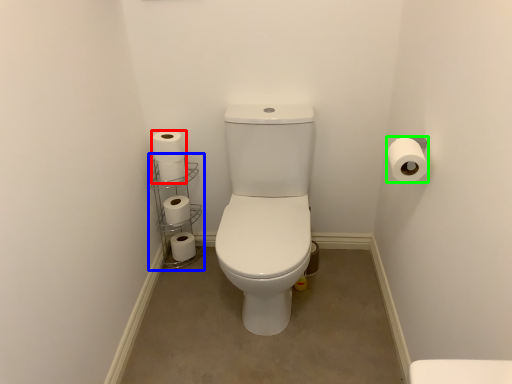
Question: Estimate the real-world distances between objects in this image. Which object is farther from toilet paper (highlighted by a red box), shelf (highlighted by a blue box) or toilet paper (highlighted by a green box)?

Choices:
 (A) shelf
 (B) toilet paper

Answer: (B)